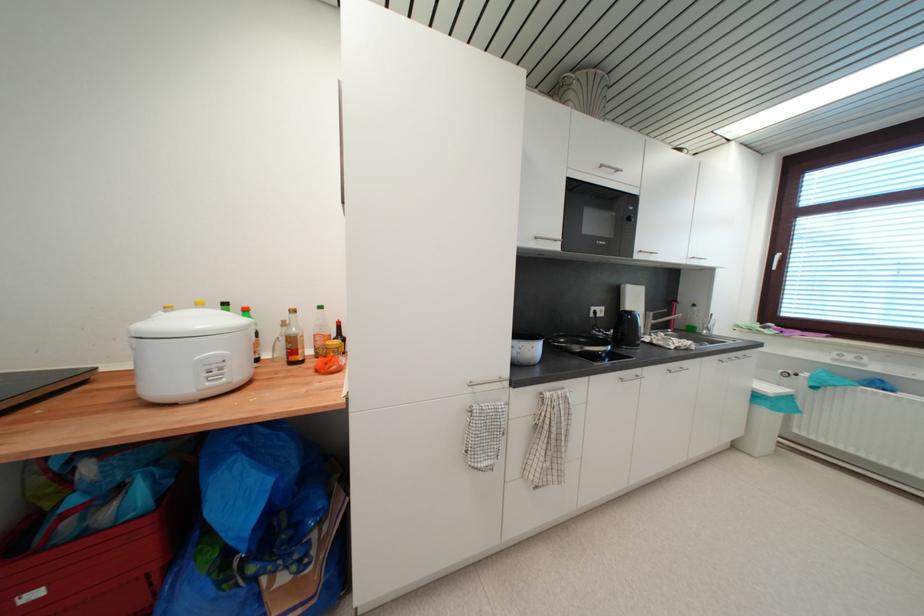
Image resolution: width=924 pixels, height=616 pixels. I want to click on white rice cooker, so click(x=190, y=354).